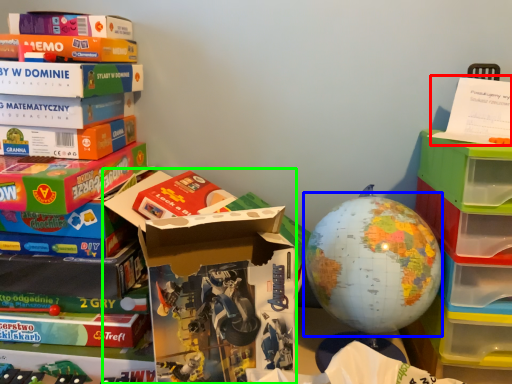
Question: Considering the real-world distances, which object is closest to paperback book (highlighted by a red box)? earth (highlighted by a blue box) or storage box (highlighted by a green box).

Choices:
 (A) earth
 (B) storage box

Answer: (A)